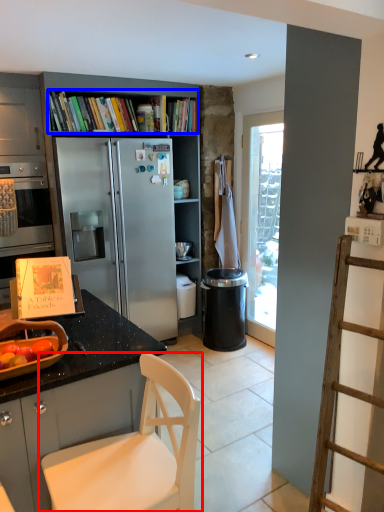
Question: Which object appears closest to the camera in this image, chair (highlighted by a red box) or book (highlighted by a blue box)?

Choices:
 (A) chair
 (B) book

Answer: (A)